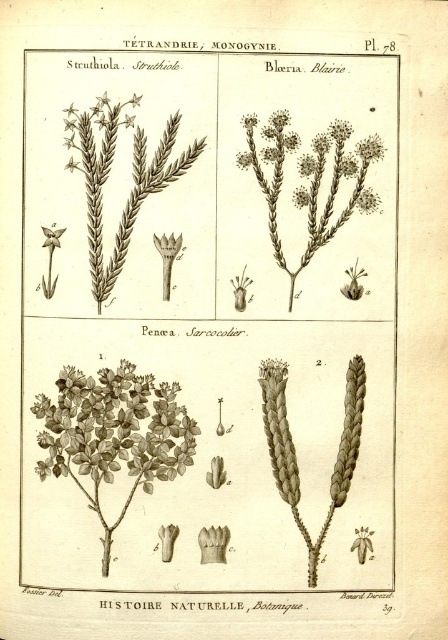
Question: Is brown textured plant at center closer to the viewer compared to matte white flower at upper left?

Choices:
 (A) no
 (B) yes

Answer: (A)

Question: Which of the following is the closest to the observer?

Choices:
 (A) brown textured plant at upper left
 (B) brown textured plant at center
 (C) white fluffy flower at upper right

Answer: (A)

Question: Among these points, which one is nearest to the camera?

Choices:
 (A) (141, 96)
 (B) (98, 220)

Answer: (A)

Question: Can you confirm if matte white star at upper left is wider than matte white flower at upper left?

Choices:
 (A) no
 (B) yes

Answer: (B)

Question: Which object is the farthest from the brown textured plant at upper left?

Choices:
 (A) matte white flower at upper left
 (B) white fluffy flower at upper right
 (C) green matte bush at center

Answer: (B)

Question: Does green matte bush at center have a smaller size compared to matte white flower at upper left?

Choices:
 (A) yes
 (B) no

Answer: (B)